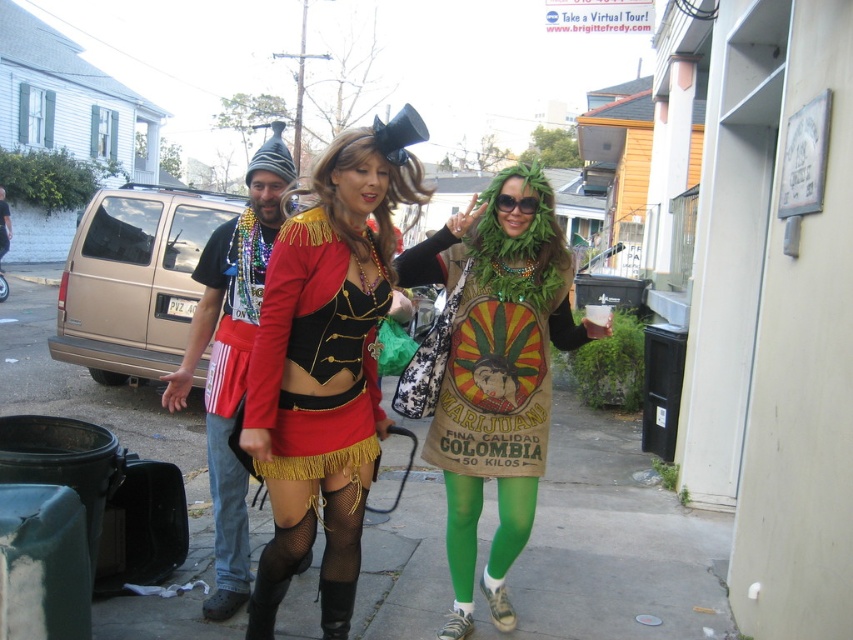
Question: Considering the real-world distances, which object is closest to the shiny red fabric dress at center?

Choices:
 (A) concrete sidewalk at center
 (B) jeans at lower left

Answer: (B)

Question: Which point is closer to the camera?

Choices:
 (A) shiny red fabric dress at center
 (B) jeans at lower left

Answer: (A)

Question: Observing the image, what is the correct spatial positioning of shiny red fabric dress at center in reference to shiny gold fringed jacket at center?

Choices:
 (A) left
 (B) right

Answer: (A)

Question: Is shiny red fabric dress at center closer to the viewer compared to jeans at lower left?

Choices:
 (A) no
 (B) yes

Answer: (B)

Question: Considering the real-world distances, which object is closest to the concrete sidewalk at center?

Choices:
 (A) shiny red fabric dress at center
 (B) jeans at lower left
 (C) green fabric bag at center
 (D) matte black t-shirt at center

Answer: (B)

Question: Does concrete sidewalk at center appear on the right side of matte black t-shirt at center?

Choices:
 (A) yes
 (B) no

Answer: (B)